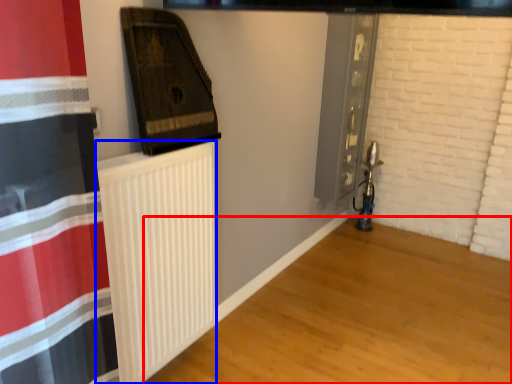
Question: Which object appears farthest to the camera in this image, wood (highlighted by a red box) or radiator (highlighted by a blue box)?

Choices:
 (A) wood
 (B) radiator

Answer: (B)